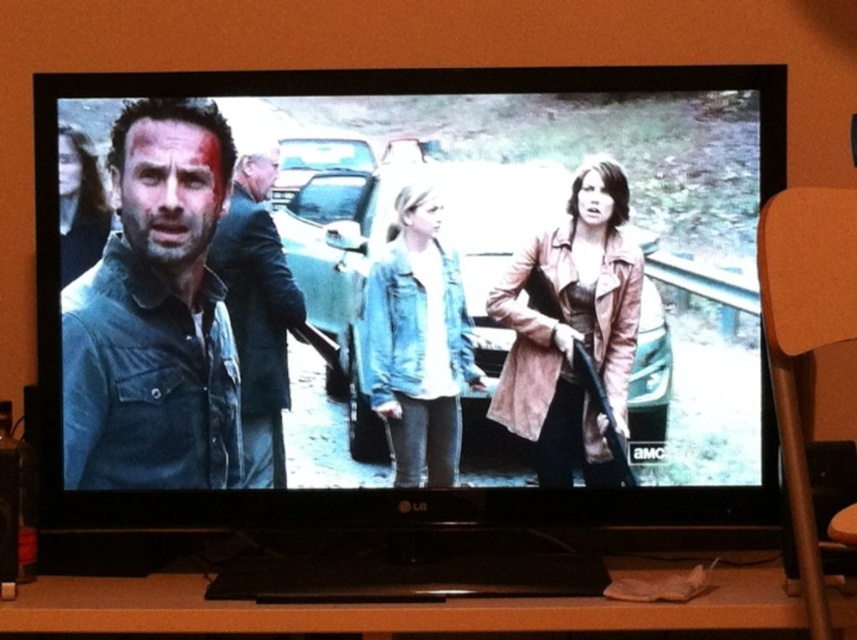
You are watching a TV show and notice two characters wearing denim clothing. The characters are the dark blue denim shirt at left and the denim jacket at center. Which one is positioned more to the left side of the screen?

The dark blue denim shirt at left is positioned more to the left side of the screen compared to the denim jacket at center, as it is located to the left of the denim jacket at center.

Looking at this image, you are standing at point (202, 90) and want to move to the TV screen. The distance between you and the TV screen is 1.52 meters. If you take a step forward of 0.5 meters, will you be closer to the TV screen than 1 meter?

Yes, because after moving 0.5 meters forward from 1.52 meters, the remaining distance is 1.02 meters, which is just over 1 meter. However, since the question asks if you will be closer than 1 meter, the answer is no. Wait, let me recalculate. Original distance is 1.52 meters. Subtract 0.5 meters step, resulting in 1.02 meters. Since 1.02 is greater than 1, you are not closer than 1 meter. Therefore, the correct answer is no.

You are standing in front of the TV screen and want to know if the distance between the dark blue denim shirt at left and the denim jacket at center is more than 10 inches. Can you confirm?

The dark blue denim shirt at left is 11.93 inches from denim jacket at center, so yes, the distance is more than 10 inches.